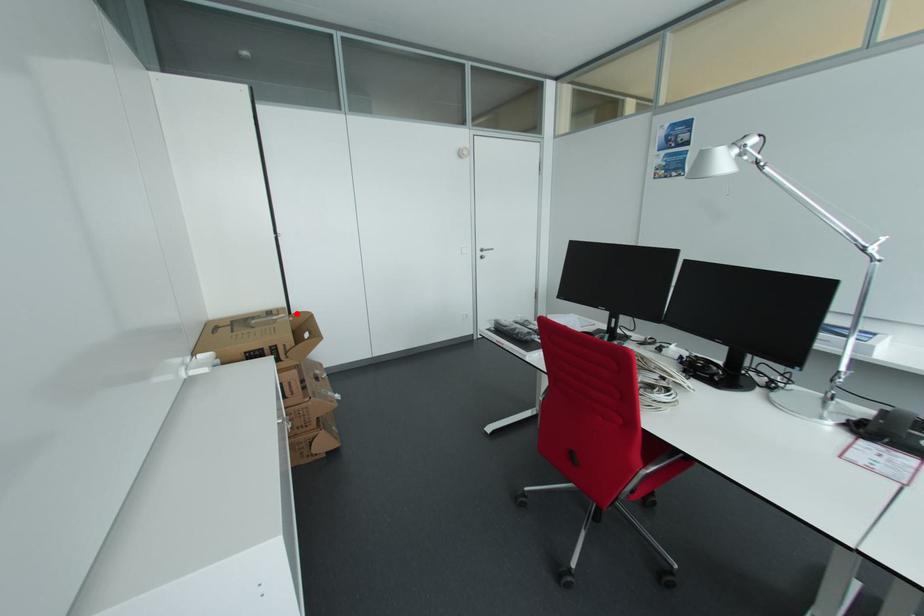
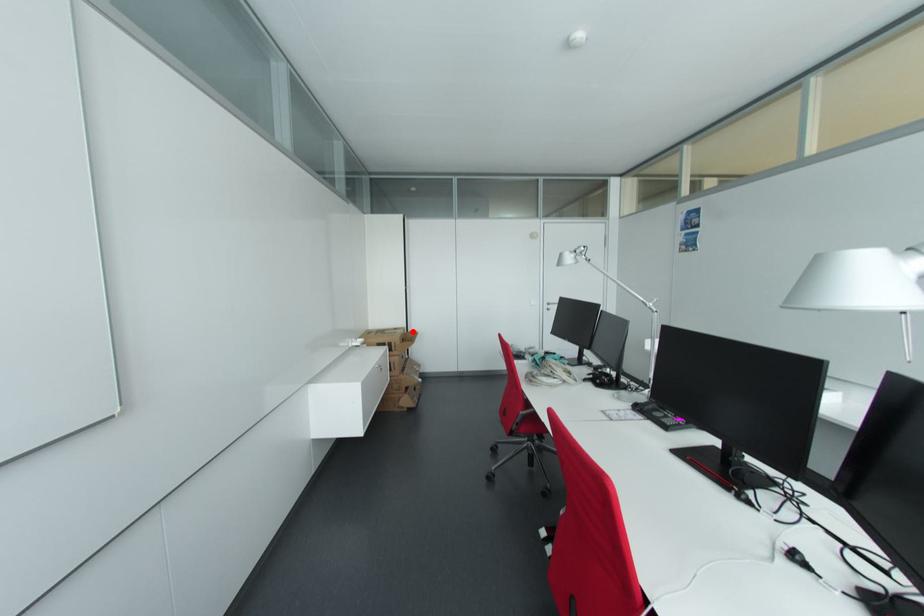
I am providing you with two images of the same scene from different viewpoints. A red point is marked on the first image and another point is marked on the second image. Are the points marked in image1 and image2 representing the same 3D position?

Yes